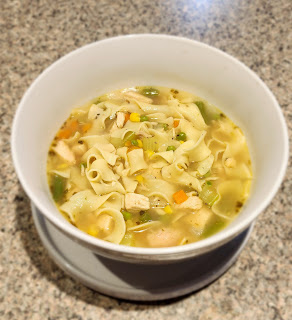
Image resolution: width=292 pixels, height=320 pixels. What are the coordinates of `1 plate` in the screenshot? It's located at (170, 278).